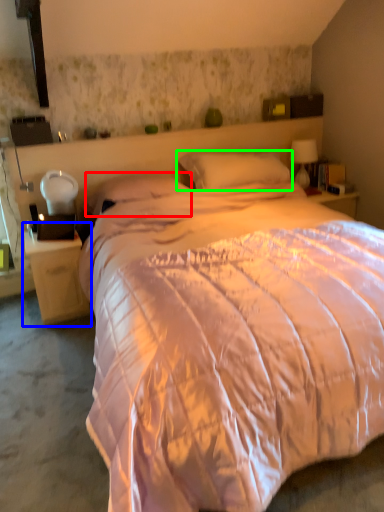
Question: Which is nearer to the pillow (highlighted by a red box)? nightstand (highlighted by a blue box) or pillow (highlighted by a green box).

Choices:
 (A) nightstand
 (B) pillow

Answer: (B)